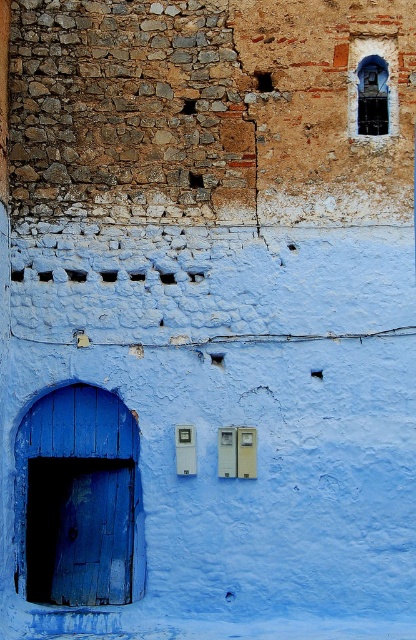
Does matte blue wooden door at left have a greater width compared to dark glass window at upper right?

Yes, matte blue wooden door at left is wider than dark glass window at upper right.

Who is lower down, matte blue wooden door at left or dark glass window at upper right?

Positioned lower is matte blue wooden door at left.

Describe the element at coordinates (79, 531) in the screenshot. The image size is (416, 640). I see `matte blue wooden door at left` at that location.

At what (x,y) coordinates should I click in order to perform the action: click on matte blue wooden door at left. Please return your answer as a coordinate pair (x, y). The image size is (416, 640). Looking at the image, I should click on (79, 531).

Does dark blue stone window at upper right come in front of dark glass window at upper right?

That is True.

Which is behind, point (364, 80) or point (359, 74)?

The point (364, 80) is behind.

Between point (376, 115) and point (364, 88), which one is positioned behind?

Point (364, 88)

Locate an element on the screen. dark blue stone window at upper right is located at coordinates (373, 88).

Who is taller, matte blue wooden door at left or dark blue stone window at upper right?

Standing taller between the two is matte blue wooden door at left.

Can you confirm if matte blue wooden door at left is positioned to the right of dark blue stone window at upper right?

In fact, matte blue wooden door at left is to the left of dark blue stone window at upper right.

At what (x,y) coordinates should I click in order to perform the action: click on matte blue wooden door at left. Please return your answer as a coordinate pair (x, y). Looking at the image, I should click on (79, 531).